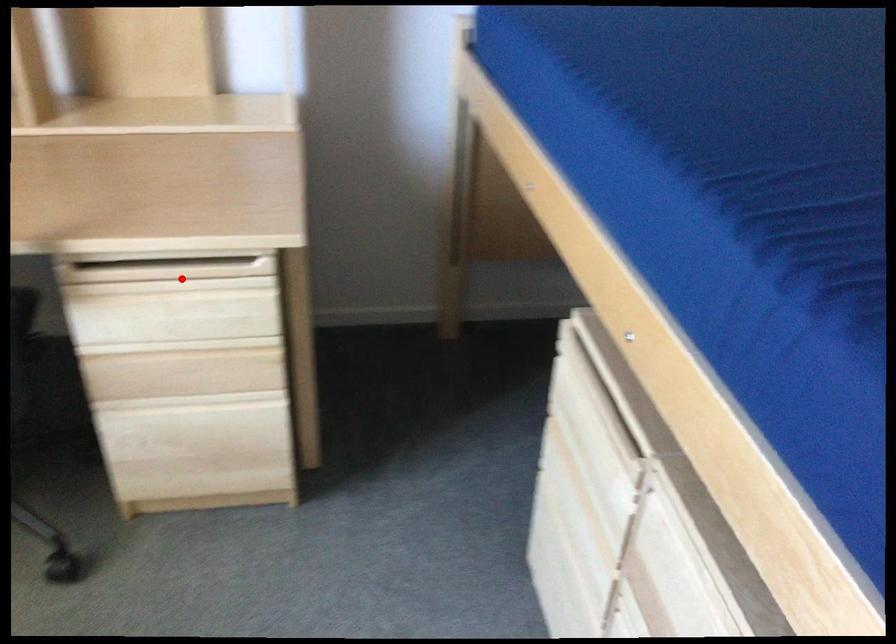
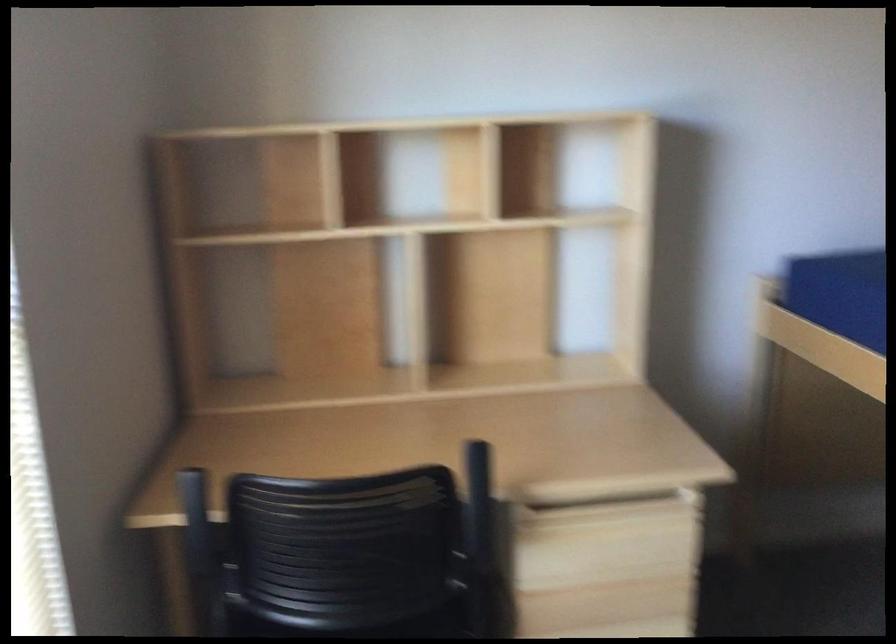
Question: A red point is marked in image1. In image2, is the corresponding 3D point closer to the camera or farther? Reply with the corresponding letter.

Choices:
 (A) The corresponding 3D point is closer.
 (B) The corresponding 3D point is farther.

Answer: (B)